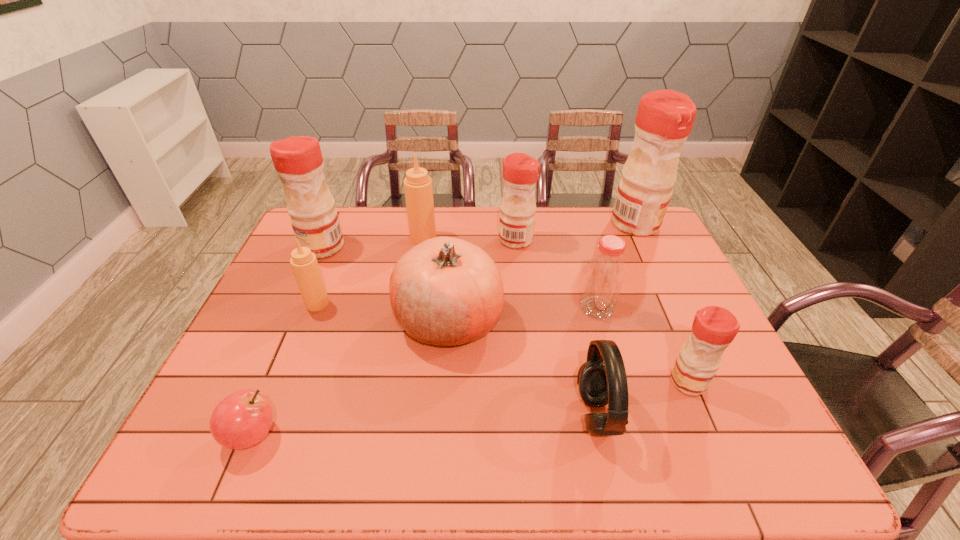
The height and width of the screenshot is (540, 960). In order to click on the left tan condiment in this screenshot , I will do [x=304, y=264].

At what (x,y) coordinates should I click in order to perform the action: click on the smaller tan condiment. Please return your answer as a coordinate pair (x, y). Looking at the image, I should click on (304, 264).

Identify the location of the nearest red condiment. point(714,328).

Where is `the smallest red condiment`? The width and height of the screenshot is (960, 540). the smallest red condiment is located at coordinates (714, 328).

At what (x,y) coordinates should I click in order to perform the action: click on headset. Please return your answer as a coordinate pair (x, y). Looking at the image, I should click on (602, 380).

I want to click on the shortest object, so click(241, 420).

Identify the location of apple. (241, 420).

Where is `blank area located on the front of the biggest red condiment`? The image size is (960, 540). blank area located on the front of the biggest red condiment is located at coordinates (663, 282).

Where is `vacant space located on the front of the ninth shortest object`? Image resolution: width=960 pixels, height=540 pixels. vacant space located on the front of the ninth shortest object is located at coordinates (297, 305).

You are a GUI agent. You are given a task and a screenshot of the screen. Output one action in this format:
    pyautogui.click(x=<x>, y=<y>)
    Task: Click on the vacant region located on the front of the farther tan condiment
    The width and height of the screenshot is (960, 540).
    Given the screenshot: What is the action you would take?
    pyautogui.click(x=413, y=301)